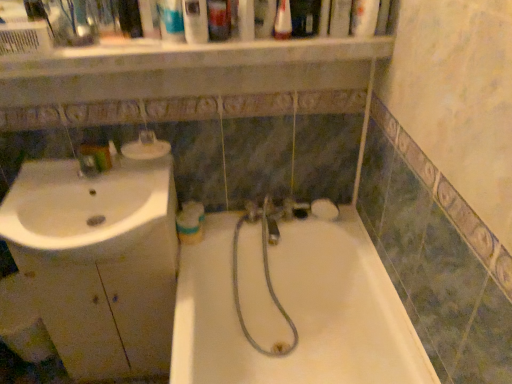
Question: Considering the relative sizes of matte plastic container at upper left, the second toiletry positioned from the right, and white glossy sink at left in the image provided, is matte plastic container at upper left, the second toiletry positioned from the right, smaller than white glossy sink at left?

Choices:
 (A) yes
 (B) no

Answer: (A)

Question: From the image's perspective, is matte plastic container at upper left, the second toiletry from the front, over white glossy sink at left?

Choices:
 (A) yes
 (B) no

Answer: (A)

Question: Can you confirm if matte plastic container at upper left, which is counted as the 1th toiletry, starting from the left, is bigger than white glossy sink at left?

Choices:
 (A) no
 (B) yes

Answer: (A)

Question: Can you confirm if matte plastic container at upper left, the second toiletry from the front, is thinner than white glossy sink at left?

Choices:
 (A) no
 (B) yes

Answer: (B)

Question: From a real-world perspective, is matte plastic container at upper left, the second toiletry from the front, under white glossy sink at left?

Choices:
 (A) yes
 (B) no

Answer: (B)

Question: Does matte plastic container at upper left, which is counted as the 1th toiletry, starting from the back, turn towards white glossy sink at left?

Choices:
 (A) yes
 (B) no

Answer: (B)

Question: Is matte plastic container at upper left, the second toiletry from the front, facing away from clear plastic mouthwash at upper center, the 3th mouthwash when ordered from bottom to top?

Choices:
 (A) yes
 (B) no

Answer: (B)

Question: Considering the relative sizes of matte plastic container at upper left, which is counted as the 1th toiletry, starting from the back, and clear plastic mouthwash at upper center, placed as the first mouthwash when sorted from front to back, in the image provided, is matte plastic container at upper left, which is counted as the 1th toiletry, starting from the back, smaller than clear plastic mouthwash at upper center, placed as the first mouthwash when sorted from front to back,?

Choices:
 (A) yes
 (B) no

Answer: (A)

Question: Is matte plastic container at upper left, arranged as the 2th toiletry when viewed from the top, wider than clear plastic mouthwash at upper center, the 2th mouthwash from the right?

Choices:
 (A) no
 (B) yes

Answer: (B)

Question: Does matte plastic container at upper left, which is counted as the 1th toiletry, starting from the back, have a lesser height compared to clear plastic mouthwash at upper center, which is the 4th mouthwash from back to front?

Choices:
 (A) no
 (B) yes

Answer: (B)

Question: Is matte plastic container at upper left, which is counted as the 1th toiletry, starting from the left, bigger than clear plastic mouthwash at upper center, which is the 4th mouthwash from back to front?

Choices:
 (A) no
 (B) yes

Answer: (A)

Question: From the image's perspective, does matte plastic container at upper left, arranged as the 2th toiletry when viewed from the top, appear lower than clear plastic mouthwash at upper center, which is the 4th mouthwash from back to front?

Choices:
 (A) yes
 (B) no

Answer: (A)

Question: Is translucent plastic soap dispenser at upper center, the 2th toiletry from the left, further to the viewer compared to white glossy bathtub at center?

Choices:
 (A) yes
 (B) no

Answer: (A)